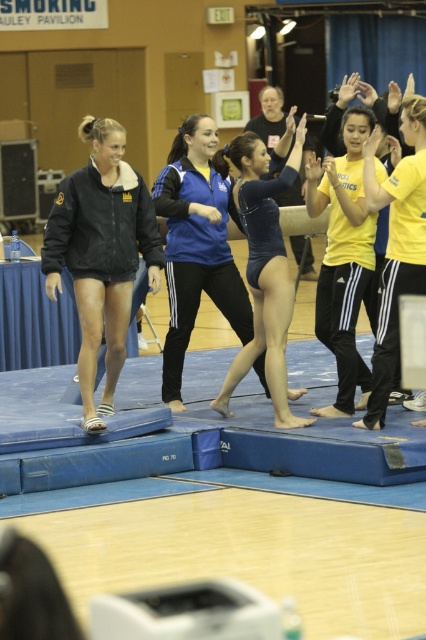
Question: Which of the following is the farthest from the observer?

Choices:
 (A) yellow matte athletic top at right
 (B) black fleece jacket at left
 (C) blue leotard at center

Answer: (A)

Question: Does black fleece jacket at left appear over blue leotard at center?

Choices:
 (A) yes
 (B) no

Answer: (B)

Question: Does black fleece jacket at left have a lesser width compared to blue leotard at center?

Choices:
 (A) yes
 (B) no

Answer: (B)

Question: Among these objects, which one is farthest from the camera?

Choices:
 (A) yellow matte athletic top at right
 (B) black fleece jacket at left

Answer: (A)

Question: Can you confirm if black fleece jacket at left is bigger than blue leotard at center?

Choices:
 (A) no
 (B) yes

Answer: (A)

Question: Considering the real-world distances, which object is closest to the yellow matte athletic top at right?

Choices:
 (A) blue leotard at center
 (B) black fleece jacket at left

Answer: (A)